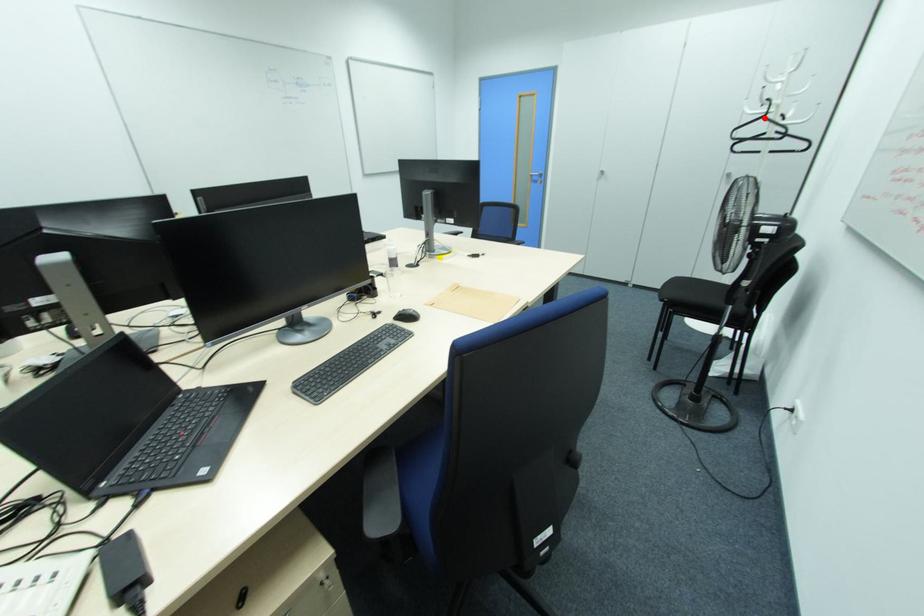
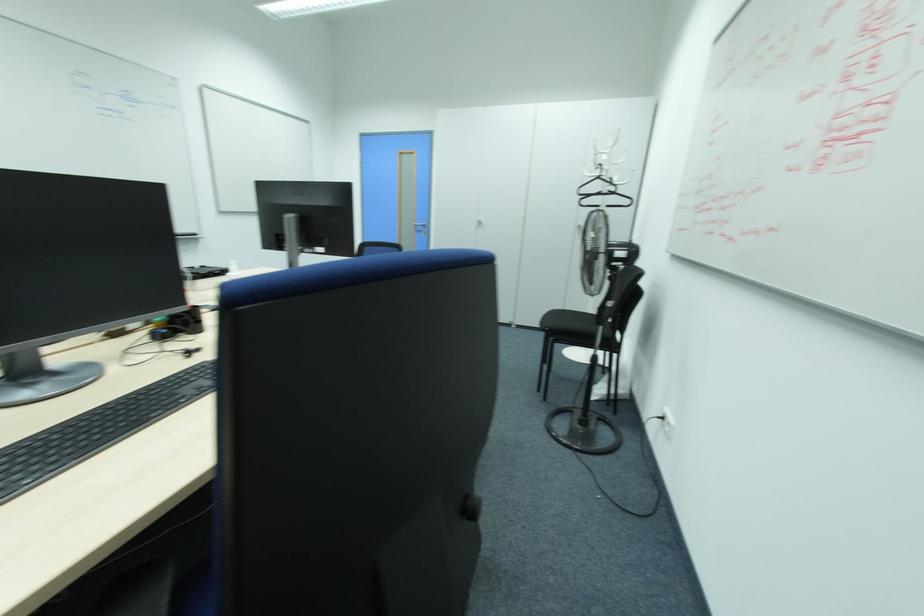
Locate, in the second image, the point that corresponds to the highlighted location in the first image.

(599, 177)